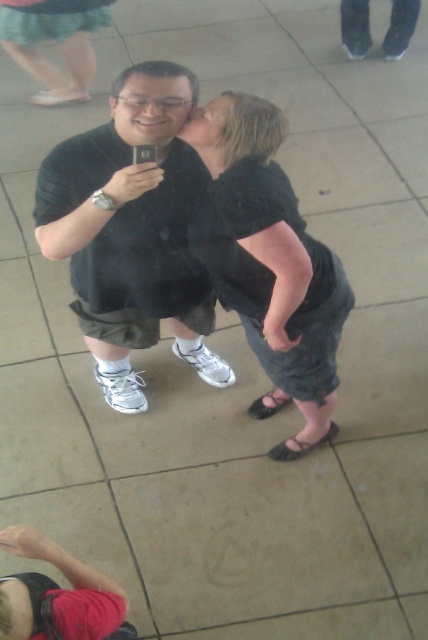
You are a photographer trying to frame a shot. You see the black matte shirt at center and the matte black hair at upper center. Which object is wider in the current scene?

The black matte shirt at center is wider than the matte black hair at upper center according to the description.

You are a photographer trying to capture the scene. Which object, the black matte shirt at center or the matte black hair at upper center, will appear closer to the camera in the photo?

The black matte shirt at center will appear closer to the camera because the matte black hair at upper center is positioned behind it.